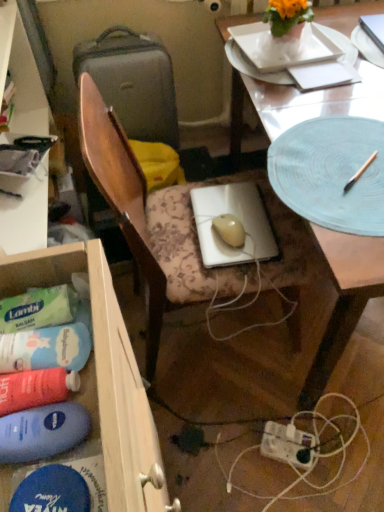
Question: In terms of width, does translucent glass desk at center look wider or thinner when compared to white paper at upper right?

Choices:
 (A) thin
 (B) wide

Answer: (B)

Question: From their relative heights in the image, would you say translucent glass desk at center is taller or shorter than white paper at upper right?

Choices:
 (A) tall
 (B) short

Answer: (A)

Question: Considering the real-world distances, which object is closest to the wooden drawer at lower left?

Choices:
 (A) white paper at upper right
 (B) white plastic power plugs and sockets at lower center
 (C) light blue textured platter at upper right
 (D) translucent glass desk at center
 (E) matte gray suitcase at left

Answer: (C)

Question: Which object is positioned closest to the blue matte paper plate at upper right?

Choices:
 (A) wooden drawer at lower left
 (B) white paper at upper right
 (C) white plastic power plugs and sockets at lower center
 (D) light blue textured platter at upper right
 (E) wooden chair at center

Answer: (B)